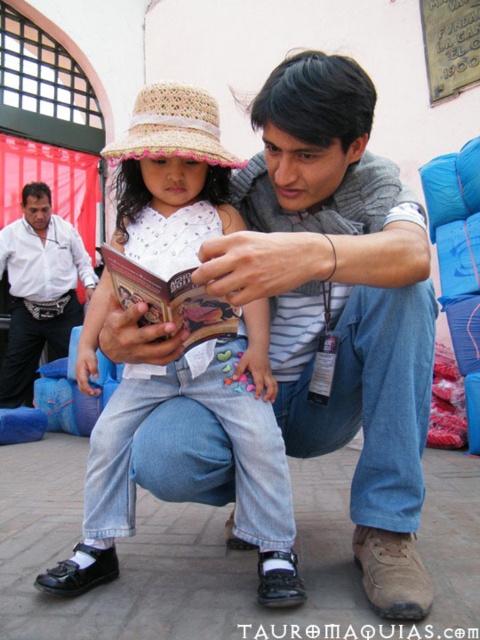
Question: Which of the following is the closest to the observer?

Choices:
 (A) (257, 529)
 (B) (165, 310)

Answer: (B)

Question: Is white lace dress at center wider than strawmaterial/texturehat at upper center?

Choices:
 (A) yes
 (B) no

Answer: (A)

Question: Can you confirm if white shirt at left is positioned to the right of strawmaterial/texturehat at upper center?

Choices:
 (A) yes
 (B) no

Answer: (B)

Question: Which object appears farthest from the camera in this image?

Choices:
 (A) hardcover book at center
 (B) white lace dress at center
 (C) strawmaterial/texturehat at upper center
 (D) white shirt at left

Answer: (D)

Question: Which object is closer to the camera taking this photo?

Choices:
 (A) white lace dress at center
 (B) hardcover book at center

Answer: (B)

Question: From the image, what is the correct spatial relationship of strawmaterial/texturehat at upper center in relation to hardcover book at center?

Choices:
 (A) right
 (B) left

Answer: (B)